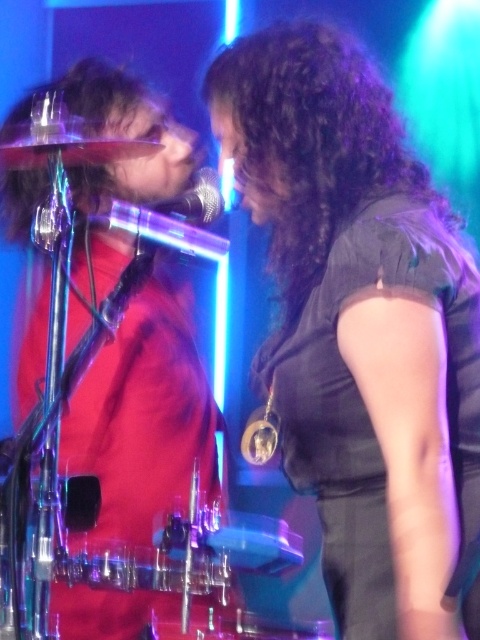
Is black matte dress at center positioned in front of red matte shirt at left?

That is True.

Identify the location of black matte dress at center. (360, 323).

Is point (276, 115) farther from camera compared to point (45, 182)?

That is False.

The image size is (480, 640). Find the location of `black matte dress at center`. black matte dress at center is located at coordinates coord(360,323).